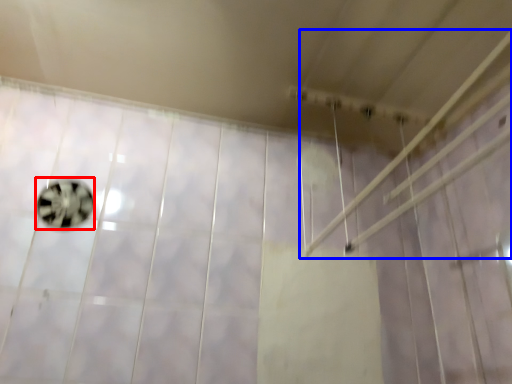
Question: Which point is further to the camera, ball (highlighted by a red box) or shower (highlighted by a blue box)?

Choices:
 (A) ball
 (B) shower

Answer: (A)